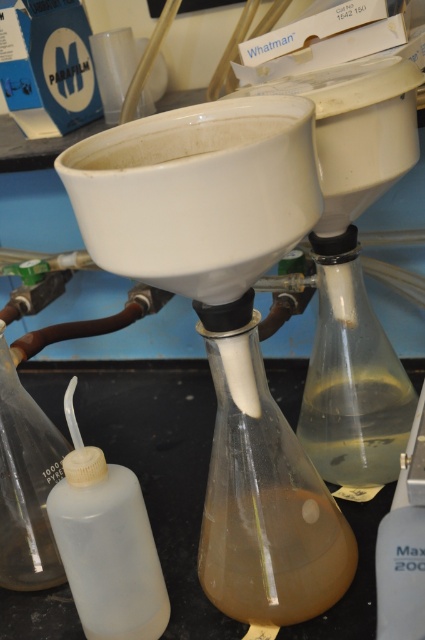
Question: Which point is closer to the camera?

Choices:
 (A) (59, 509)
 (B) (411, 422)
 (C) (322, 525)

Answer: (A)

Question: Is white matte funnel at center below brown translucent liquid at center?

Choices:
 (A) yes
 (B) no

Answer: (B)

Question: Is brown translucent liquid at center positioned before translucent gel-like liquid at center?

Choices:
 (A) no
 (B) yes

Answer: (B)

Question: Does translucent plastic bottle at lower left appear over translucent gel-like liquid at center?

Choices:
 (A) no
 (B) yes

Answer: (A)

Question: Which point is farther to the camera?

Choices:
 (A) (249, 310)
 (B) (53, 518)
 (C) (206, 580)
 (D) (402, 376)

Answer: (D)

Question: Considering the real-world distances, which object is farthest from the white matte funnel at center?

Choices:
 (A) translucent plastic bottle at lower left
 (B) brown translucent liquid at center

Answer: (A)